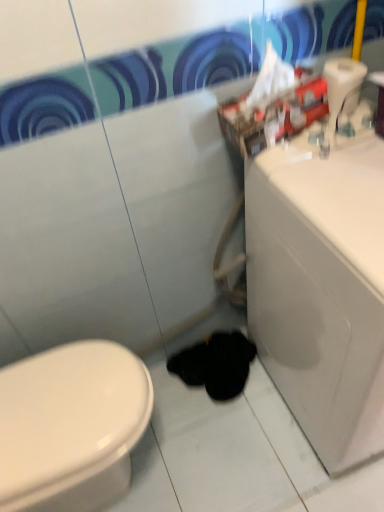
Find the location of a particular element. black fuzzy animal at lower center is located at coordinates (215, 364).

Locate an element on the screen. white glossy sink at right is located at coordinates (321, 286).

Considering the relative positions of black fuzzy animal at lower center and white glossy sink at right in the image provided, is black fuzzy animal at lower center in front of white glossy sink at right?

No, it is not.

From the image's perspective, which is below, black fuzzy animal at lower center or white glossy sink at right?

black fuzzy animal at lower center.

Based on the photo, would you say black fuzzy animal at lower center is a long distance from white glossy sink at right?

No, there isn't a large distance between black fuzzy animal at lower center and white glossy sink at right.

Based on the photo, is black fuzzy animal at lower center situated inside white glossy sink at right or outside?

black fuzzy animal at lower center exists outside the volume of white glossy sink at right.

Based on the photo, considering the relative positions of white plastic toilet paper at upper right and white glossy sink at right in the image provided, is white plastic toilet paper at upper right to the left of white glossy sink at right from the viewer's perspective?

Yes.

Which object is closer to the camera, white plastic toilet paper at upper right or white glossy sink at right?

white glossy sink at right is more forward.

Looking at this image, is white glossy sink at right located within white plastic toilet paper at upper right?

Definitely not — white glossy sink at right is not inside white plastic toilet paper at upper right.

Considering the sizes of white plastic toilet paper at upper right and black fuzzy animal at lower center in the image, is white plastic toilet paper at upper right wider or thinner than black fuzzy animal at lower center?

Clearly, white plastic toilet paper at upper right has less width compared to black fuzzy animal at lower center.

Is white plastic toilet paper at upper right oriented away from black fuzzy animal at lower center?

No.

Which is farther from the camera, (334, 88) or (222, 337)?

Point (222, 337)

Who is taller, white plastic toilet paper at upper right or black fuzzy animal at lower center?

Standing taller between the two is white plastic toilet paper at upper right.

Is point (221, 383) farther from viewer compared to point (330, 62)?

Yes, it is.

Is white plastic toilet paper at upper right at the back of black fuzzy animal at lower center?

No.

Is black fuzzy animal at lower center at the left side of white plastic toilet paper at upper right?

Yes.

Is black fuzzy animal at lower center located outside white plastic toilet paper at upper right?

black fuzzy animal at lower center is positioned outside white plastic toilet paper at upper right.

Is white glossy sink at right not within white plastic toilet paper at upper right?

white glossy sink at right lies outside white plastic toilet paper at upper right's area.

In the image, is white glossy sink at right positioned in front of or behind white plastic toilet paper at upper right?

Clearly, white glossy sink at right is in front of white plastic toilet paper at upper right.

Does white glossy sink at right turn towards white plastic toilet paper at upper right?

No, white glossy sink at right is not turned towards white plastic toilet paper at upper right.

From a real-world perspective, between white glossy sink at right and black fuzzy animal at lower center, who is vertically higher?

white glossy sink at right, from a real-world perspective.

Is white glossy sink at right inside or outside of black fuzzy animal at lower center?

The correct answer is: outside.

Between white glossy sink at right and black fuzzy animal at lower center, which one appears on the left side from the viewer's perspective?

Positioned to the left is black fuzzy animal at lower center.

Between white glossy sink at right and black fuzzy animal at lower center, which one is positioned in front?

Positioned in front is white glossy sink at right.

The image size is (384, 512). Find the location of `porcelain in front of the black fuzzy animal at lower center`. porcelain in front of the black fuzzy animal at lower center is located at coordinates (321, 286).

At what (x,y) coordinates should I click in order to perform the action: click on porcelain below the white plastic toilet paper at upper right (from a real-world perspective). Please return your answer as a coordinate pair (x, y). Looking at the image, I should click on (321, 286).

In the scene shown: When comparing their distances from white plastic toilet paper at upper right, does white glossy sink at right or black fuzzy animal at lower center seem closer?

white glossy sink at right is closer to white plastic toilet paper at upper right.

From the image, which object appears to be farther from white plastic toilet paper at upper right, black fuzzy animal at lower center or white glossy sink at right?

Among the two, black fuzzy animal at lower center is located further to white plastic toilet paper at upper right.

Based on their spatial positions, is white glossy sink at right or white plastic toilet paper at upper right further from black fuzzy animal at lower center?

Based on the image, white plastic toilet paper at upper right appears to be further to black fuzzy animal at lower center.

Which object lies further to the anchor point white glossy sink at right, black fuzzy animal at lower center or white plastic toilet paper at upper right?

The object further to white glossy sink at right is black fuzzy animal at lower center.

In the scene shown: Which object lies nearer to the anchor point white glossy sink at right, white plastic toilet paper at upper right or black fuzzy animal at lower center?

white plastic toilet paper at upper right is positioned closer to the anchor white glossy sink at right.

Estimate the real-world distances between objects in this image. Which object is further from black fuzzy animal at lower center, white plastic toilet paper at upper right or white glossy sink at right?

white plastic toilet paper at upper right is further to black fuzzy animal at lower center.

This screenshot has width=384, height=512. What are the coordinates of `porcelain between white plastic toilet paper at upper right and black fuzzy animal at lower center in the vertical direction` in the screenshot? It's located at tap(321, 286).